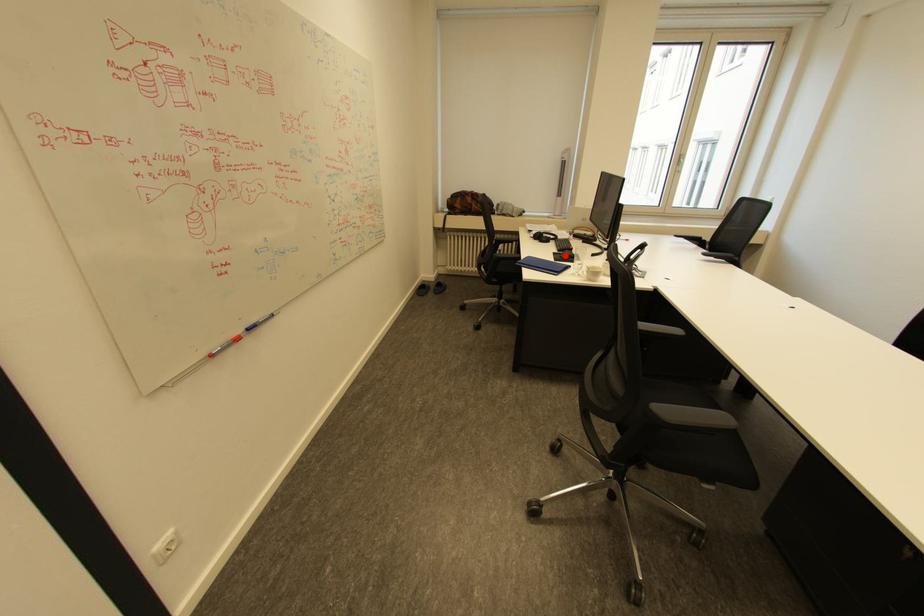
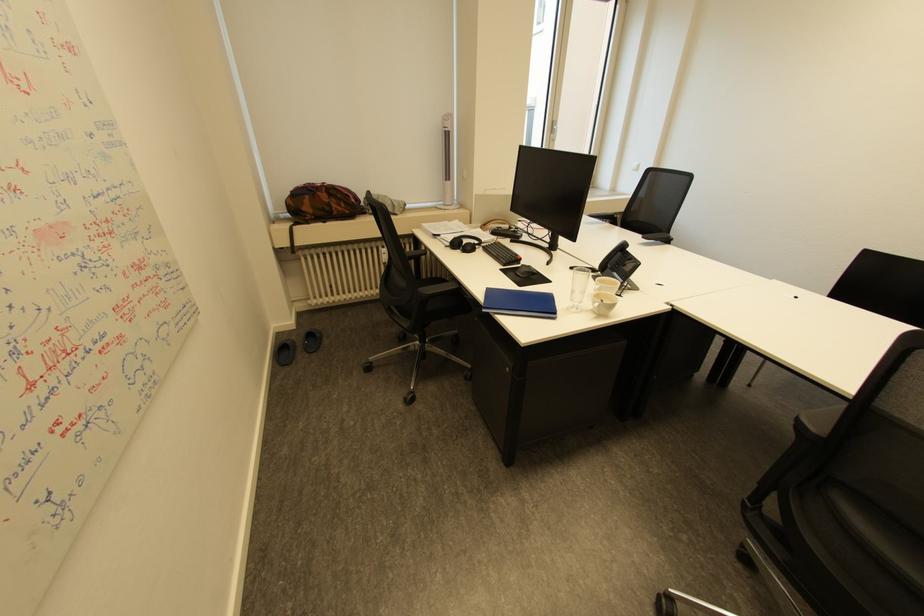
Question: I am providing you with two images of the same scene from different viewpoints. In image1, a red point is highlighted. Considering the same 3D point in image2, which of the following is correct?

Choices:
 (A) It is closer
 (B) It is farther

Answer: (B)